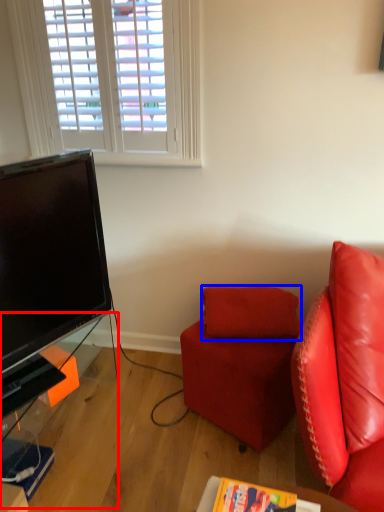
Question: Which of the following is the closest to the observer, table (highlighted by a red box) or pillow (highlighted by a blue box)?

Choices:
 (A) table
 (B) pillow

Answer: (A)